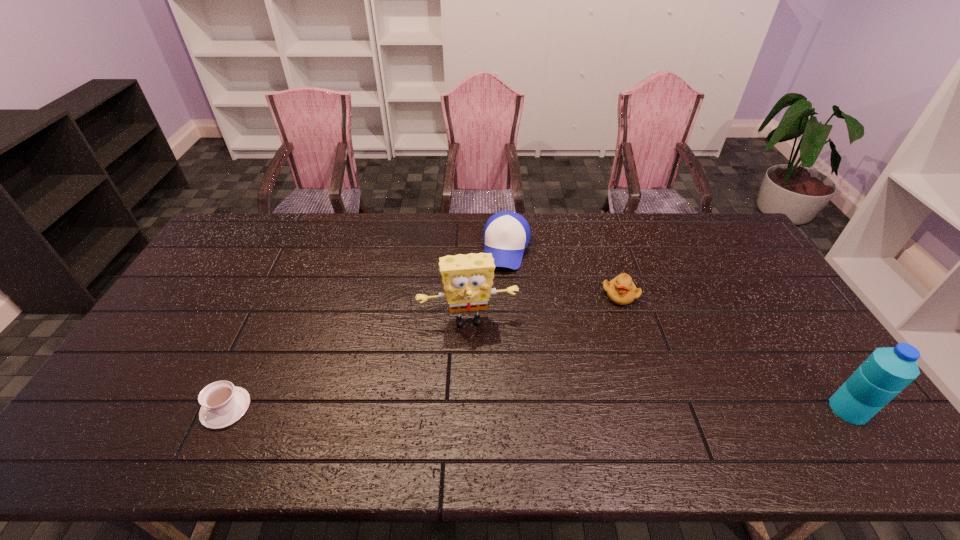
Identify the location of free spot located 0.170m on the handle side of the shortest object. The height and width of the screenshot is (540, 960). (133, 408).

Identify the location of vacant region located 0.250m on the back of the rightmost object. (789, 321).

Find the location of `free space located at the beak of the duckling`. free space located at the beak of the duckling is located at coordinates (597, 372).

The height and width of the screenshot is (540, 960). I want to click on vacant space located 0.340m at the beak of the duckling, so click(x=590, y=395).

What are the coordinates of `free space located at the beak of the duckling` in the screenshot? It's located at (612, 320).

Where is `vacant space located on the front-facing side of the farthest object`? The height and width of the screenshot is (540, 960). vacant space located on the front-facing side of the farthest object is located at coordinates (486, 354).

You are a GUI agent. You are given a task and a screenshot of the screen. Output one action in this format:
    pyautogui.click(x=<x>, y=<y>)
    Task: Click on the vacant area situated 0.060m on the front-facing side of the farthest object
    
    Given the screenshot: What is the action you would take?
    pyautogui.click(x=501, y=285)

The image size is (960, 540). Find the location of `vacant space located on the front-facing side of the farthest object`. vacant space located on the front-facing side of the farthest object is located at coordinates (501, 285).

This screenshot has width=960, height=540. I want to click on blank space located 0.140m on the face of the sponge, so click(x=480, y=375).

Where is `free location located on the face of the sponge`? free location located on the face of the sponge is located at coordinates (478, 363).